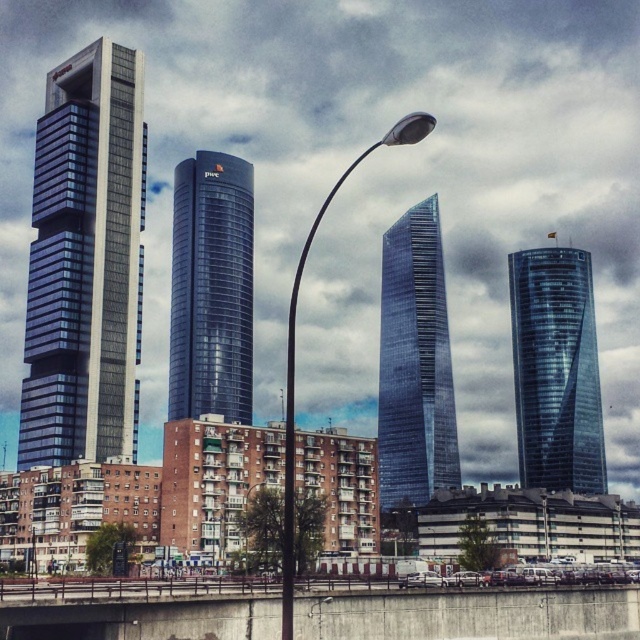
Question: Which of the following is the farthest from the observer?

Choices:
 (A) (390, 141)
 (B) (248, 540)
 (C) (48, 406)

Answer: (C)

Question: Is shiny glass skyscraper at center above metallic pole at center?

Choices:
 (A) no
 (B) yes

Answer: (B)

Question: Estimate the real-world distances between objects in this image. Which object is closer to the transparent glass skyscraper at right?

Choices:
 (A) metallic pole at center
 (B) glossy glass tower at center
 (C) glassy blue skyscraper at left
 (D) shiny glass skyscraper at center

Answer: (D)

Question: Which object is the farthest from the glossy metal street light at center?

Choices:
 (A) transparent glass skyscraper at right
 (B) glossy glass tower at center
 (C) shiny glass skyscraper at center

Answer: (A)

Question: Does glossy glass tower at center lie in front of transparent glass skyscraper at right?

Choices:
 (A) no
 (B) yes

Answer: (B)

Question: Is glossy glass tower at center smaller than transparent glass skyscraper at right?

Choices:
 (A) no
 (B) yes

Answer: (A)